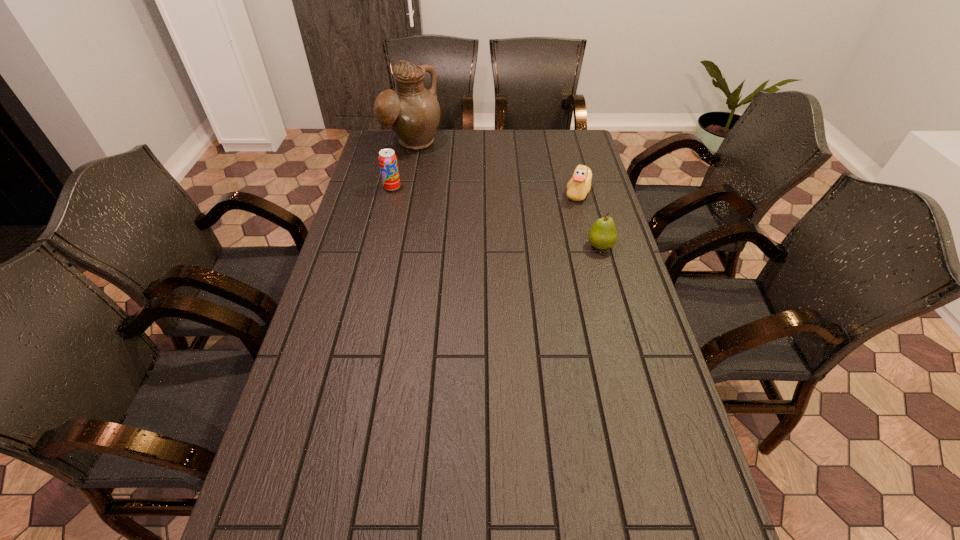
The height and width of the screenshot is (540, 960). What are the coordinates of `soda can` in the screenshot? It's located at (388, 163).

This screenshot has height=540, width=960. What are the coordinates of `pear` in the screenshot? It's located at [x=603, y=235].

Locate an element on the screen. Image resolution: width=960 pixels, height=540 pixels. duck is located at coordinates (579, 185).

Where is `pitcher`? pitcher is located at coordinates (413, 112).

Where is `the tallest object`? Image resolution: width=960 pixels, height=540 pixels. the tallest object is located at coordinates (413, 112).

Find the location of a particular element. Image resolution: width=960 pixels, height=540 pixels. vacant space located on the front of the soda can is located at coordinates (383, 226).

You are a GUI agent. You are given a task and a screenshot of the screen. Output one action in this format:
    pyautogui.click(x=<x>, y=<y>)
    Task: Click on the vacant space located on the front of the nearest object
    This screenshot has width=960, height=540.
    Given the screenshot: What is the action you would take?
    pyautogui.click(x=625, y=332)

You are a GUI agent. You are given a task and a screenshot of the screen. Output one action in this format:
    pyautogui.click(x=<x>, y=<y>)
    Task: Click on the vacant point located at the beak of the duck
    
    Given the screenshot: What is the action you would take?
    pyautogui.click(x=516, y=211)

At what (x,y) coordinates should I click in order to perform the action: click on free space located at the beak of the duck. Please return your answer as a coordinate pair (x, y). Looking at the image, I should click on (486, 219).

The image size is (960, 540). Find the location of `free location located at the beak of the duck`. free location located at the beak of the duck is located at coordinates (469, 224).